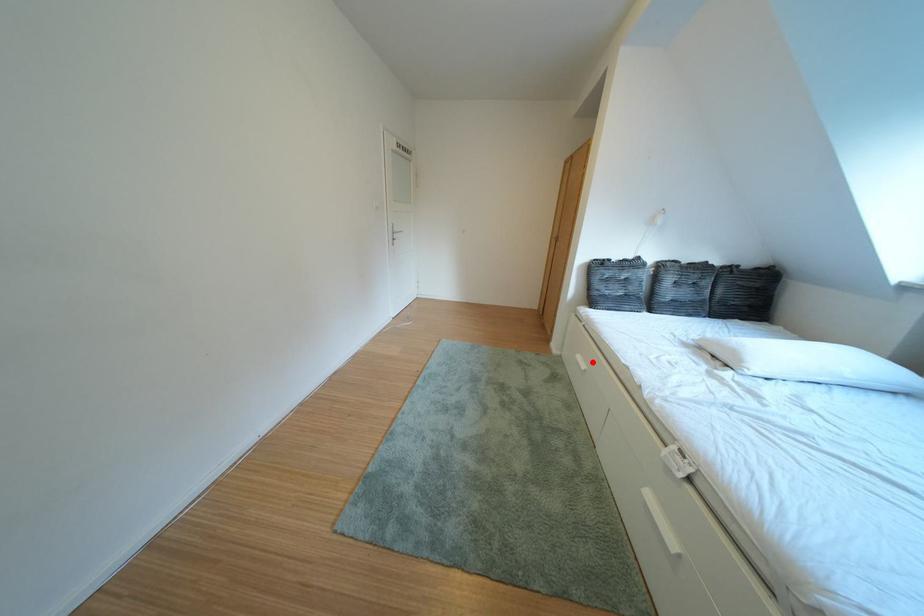
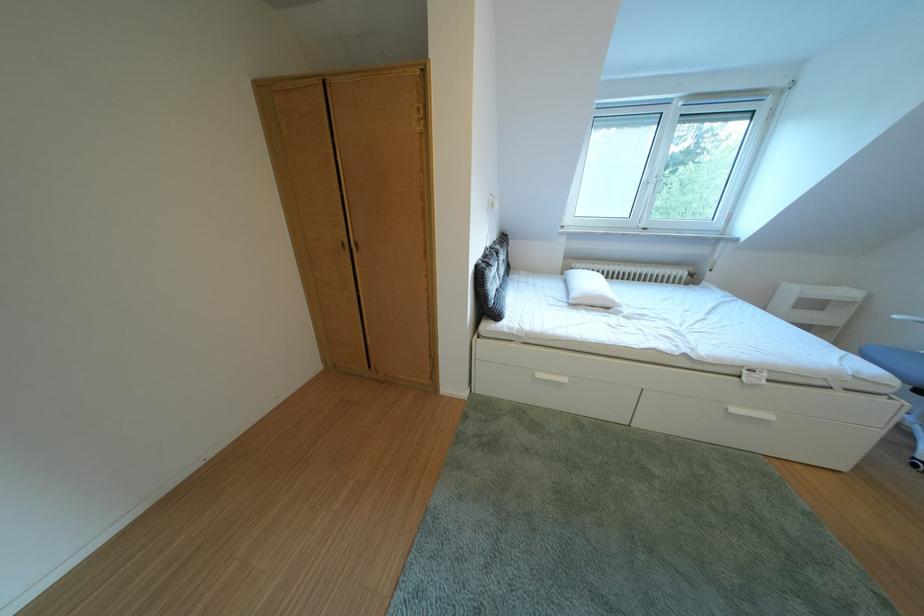
Question: I am providing you with two images of the same scene from different viewpoints. Given a red point in image1, look at the same physical point in image2. Is it:

Choices:
 (A) Closer to the viewpoint
 (B) Farther from the viewpoint

Answer: (B)